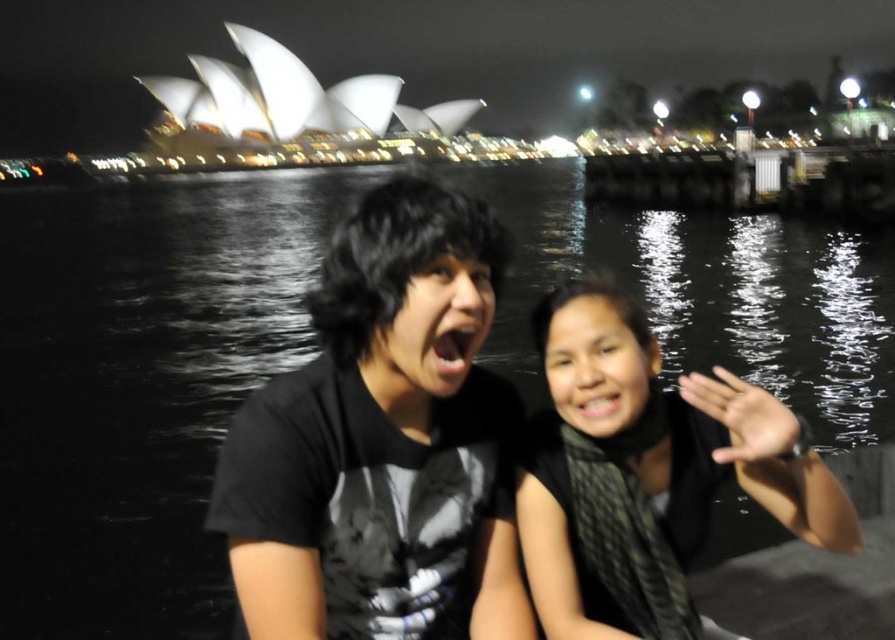
Consider the image. Who is more forward, [424,248] or [708,428]?

Point [424,248] is in front.

Is point (376, 403) less distant than point (697, 630)?

No, it is behind (697, 630).

Image resolution: width=895 pixels, height=640 pixels. Find the location of `black matte shirt at center`. black matte shirt at center is located at coordinates (382, 442).